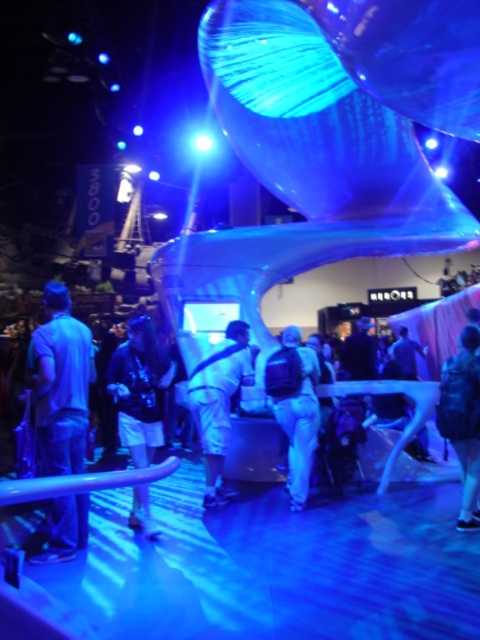
Is denim shorts at center thinner than white matte backpack at center?

Correct, denim shorts at center's width is less than white matte backpack at center's.

Who is positioned more to the right, denim shorts at center or white matte backpack at center?

From the viewer's perspective, white matte backpack at center appears more on the right side.

At what (x,y) coordinates should I click in order to perform the action: click on denim shorts at center. Please return your answer as a coordinate pair (x, y). Looking at the image, I should click on (140, 388).

Which is in front, point (84, 381) or point (245, 340)?

Positioned in front is point (84, 381).

Between matte blue shirt at left and white cotton pants at center, which one has more height?

Standing taller between the two is white cotton pants at center.

Identify the location of matte blue shirt at left. The width and height of the screenshot is (480, 640). (61, 385).

Does matte blue shirt at left have a lesser width compared to white matte backpack at center?

Yes, matte blue shirt at left is thinner than white matte backpack at center.

The height and width of the screenshot is (640, 480). I want to click on matte blue shirt at left, so click(x=61, y=385).